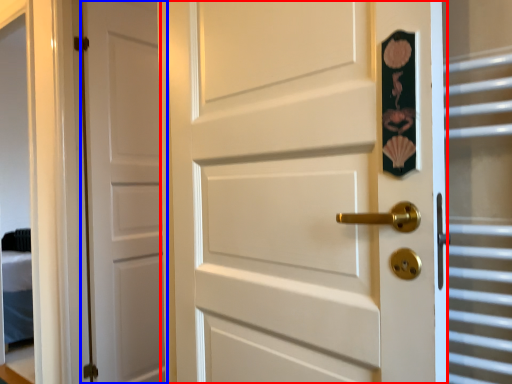
Question: Among these objects, which one is farthest to the camera, door (highlighted by a red box) or door (highlighted by a blue box)?

Choices:
 (A) door
 (B) door

Answer: (B)